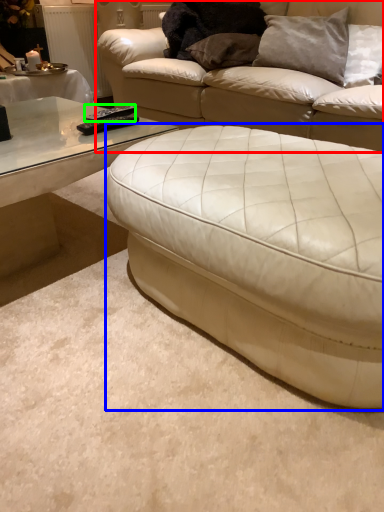
Question: Estimate the real-world distances between objects in this image. Which object is farther from studio couch (highlighted by a red box), studio couch (highlighted by a blue box) or remote (highlighted by a green box)?

Choices:
 (A) studio couch
 (B) remote

Answer: (A)